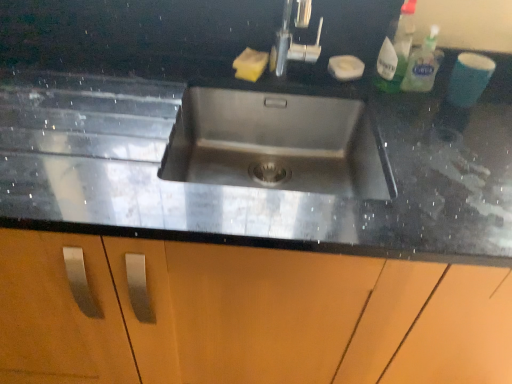
Question: Do you think yellow sponge at upper center, acting as the second soap starting from the right, is within white matte soap at upper right, which is the 2th soap from left to right, or outside of it?

Choices:
 (A) outside
 (B) inside

Answer: (A)

Question: Is point (245, 59) positioned closer to the camera than point (347, 74)?

Choices:
 (A) farther
 (B) closer

Answer: (A)

Question: Which of these objects is positioned farthest from the white matte soap at upper right, which is the 2th soap from left to right?

Choices:
 (A) black granite sink at center
 (B) translucent plastic spray bottle at upper right, which appears as the 1th cleaning product when viewed from the left
 (C) yellow sponge at upper center, acting as the second soap starting from the right
 (D) clear plastic bottle at upper right, marked as the 1th cleaning product in a right-to-left arrangement

Answer: (A)

Question: Which object is positioned farthest from the black granite sink at center?

Choices:
 (A) yellow sponge at upper center, which ranks as the first soap in left-to-right order
 (B) white matte soap at upper right, which is the 2th soap from left to right
 (C) clear plastic bottle at upper right, the 2th cleaning product positioned from the left
 (D) translucent plastic spray bottle at upper right, acting as the 2th cleaning product starting from the right

Answer: (C)